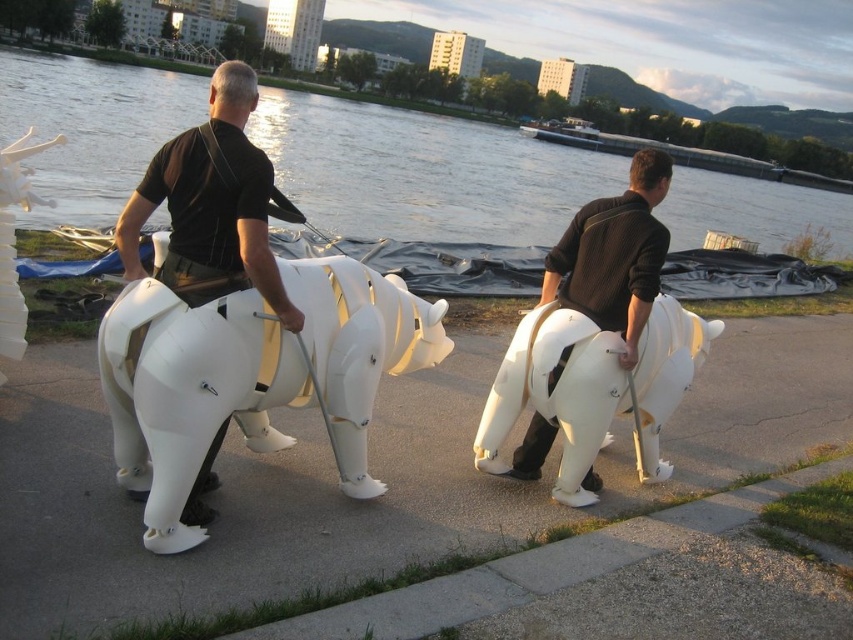
Which of these two, white plastic bear at center or matte black sweater at right, stands shorter?

white plastic bear at center

Is point (231, 544) closer to camera compared to point (578, 212)?

That is True.

Is point (80, 612) positioned behind point (560, 369)?

No, (80, 612) is closer to viewer.

Where is `white plastic bear at center`? Image resolution: width=853 pixels, height=640 pixels. white plastic bear at center is located at coordinates pos(374,474).

Does matte white robot at center have a larger size compared to matte black sweater at right?

Actually, matte white robot at center might be smaller than matte black sweater at right.

Based on the photo, is the position of matte white robot at center more distant than that of matte black sweater at right?

No, matte white robot at center is closer to the viewer.

Is point (248, 260) closer to camera compared to point (548, 257)?

Yes, it is in front of point (548, 257).

Where is `matte white robot at center`? matte white robot at center is located at coordinates (212, 200).

Who is more forward, [206,410] or [283,196]?

Positioned in front is point [206,410].

This screenshot has height=640, width=853. I want to click on white matte plastic sculpture at center, so click(x=190, y=392).